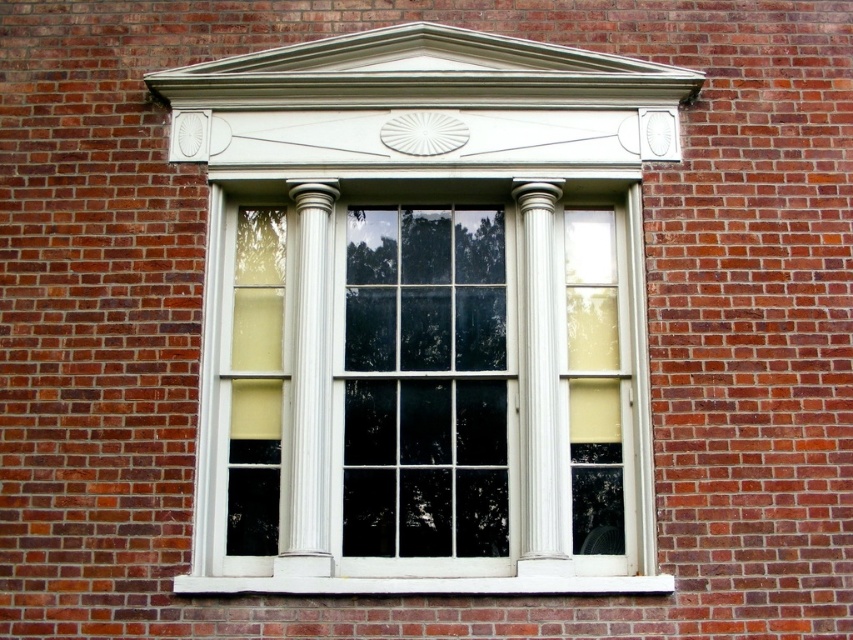
Question: Among these objects, which one is farthest from the camera?

Choices:
 (A) white glossy column at center
 (B) white painted wood at lower center

Answer: (A)

Question: Among these objects, which one is nearest to the camera?

Choices:
 (A) white painted wood at lower center
 (B) white glossy wood bay window at center

Answer: (A)

Question: Is white glossy wood bay window at center below white painted wood at lower center?

Choices:
 (A) no
 (B) yes

Answer: (A)

Question: Which is farther from the white glossy column at center?

Choices:
 (A) white painted wood at lower center
 (B) white glossy wood bay window at center

Answer: (A)

Question: Does white glossy column at center appear on the right side of white painted wood at lower center?

Choices:
 (A) yes
 (B) no

Answer: (B)

Question: Is white glossy wood bay window at center above white painted wood at lower center?

Choices:
 (A) no
 (B) yes

Answer: (B)